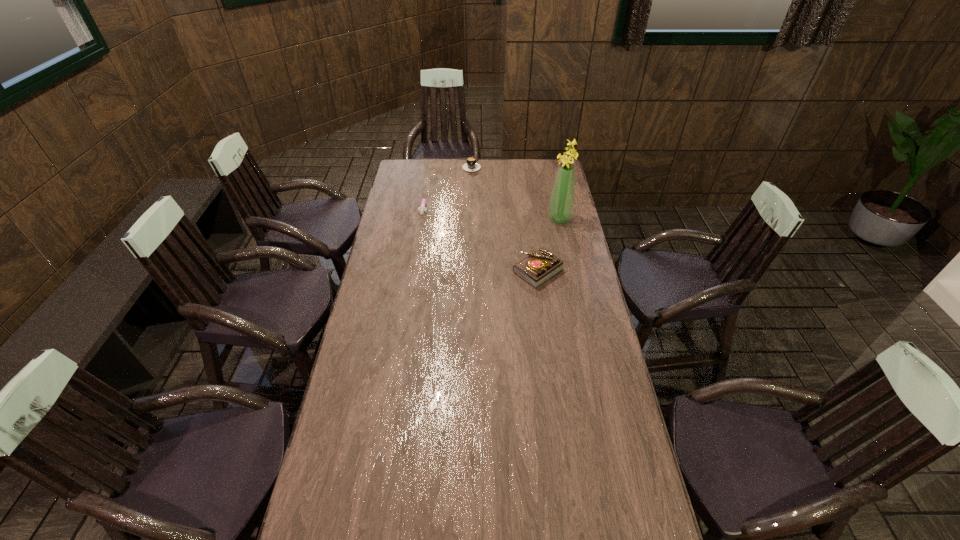
Locate an element on the screen. The height and width of the screenshot is (540, 960). vacant space on the desktop that is between the shortest object and the nearest object and is positioned on the front-facing side of the bouquet is located at coordinates (470, 232).

Find the location of `free space on the desktop that is between the leftmost object and the diary and is positioned with the handle on the side of the cappuccino`. free space on the desktop that is between the leftmost object and the diary and is positioned with the handle on the side of the cappuccino is located at coordinates (478, 237).